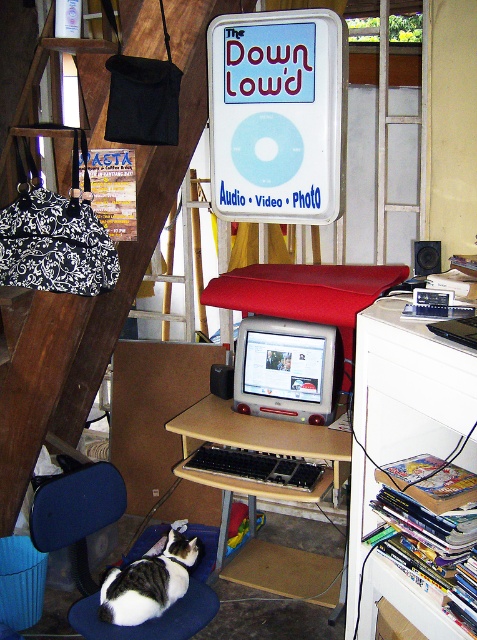
Question: Which object is positioned farthest from the matte silver monitor at center?

Choices:
 (A) black and white fur cat at lower left
 (B) black plastic keyboard at center
 (C) wooden desk at center

Answer: (A)

Question: Which point is closer to the camera taking this photo?

Choices:
 (A) (321, 378)
 (B) (355, 390)
 (C) (223, 502)

Answer: (B)

Question: Is white matte drawer at right to the left of black plastic keyboard at center from the viewer's perspective?

Choices:
 (A) yes
 (B) no

Answer: (B)

Question: Which is nearer to the matte silver monitor at center?

Choices:
 (A) wooden desk at center
 (B) black and white fur cat at lower left
 (C) black plastic computer desk at center
 (D) black plastic keyboard at center

Answer: (C)

Question: Observing the image, what is the correct spatial positioning of black plastic computer desk at center in reference to black and white fur cat at lower left?

Choices:
 (A) right
 (B) left

Answer: (A)

Question: Is wooden desk at center positioned behind black and white fur cat at lower left?

Choices:
 (A) no
 (B) yes

Answer: (A)